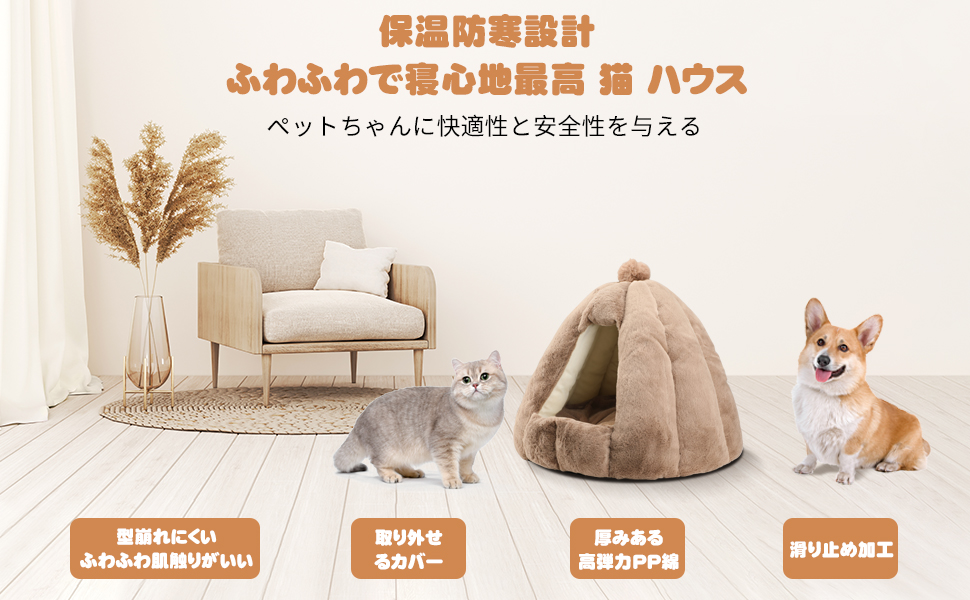
Locate an element on the screen. wooden floor is located at coordinates (528, 495).